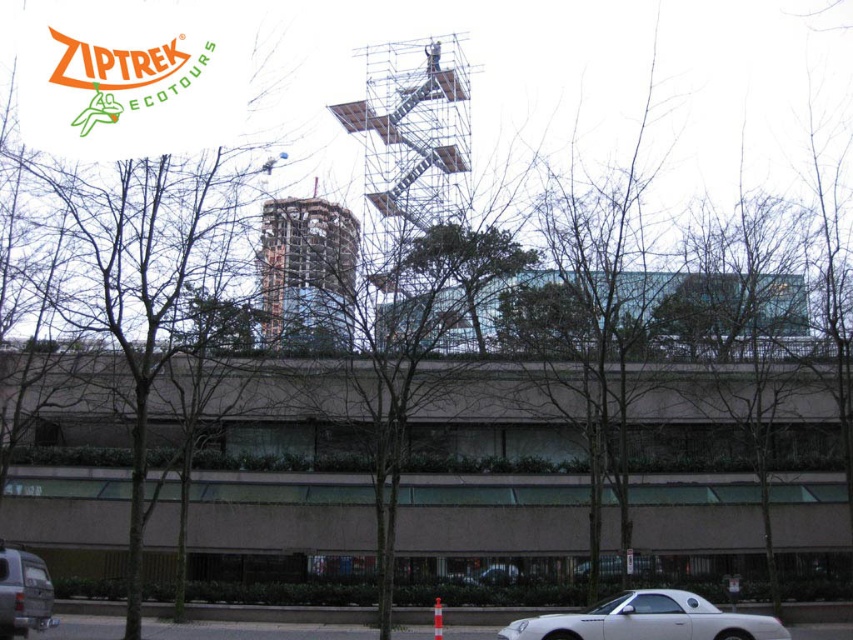
Can you confirm if silver metallic scaffolding at center is thinner than matte silver van at lower left?

Incorrect, silver metallic scaffolding at center's width is not less than matte silver van at lower left's.

Can you confirm if silver metallic scaffolding at center is positioned to the right of matte silver van at lower left?

Correct, you'll find silver metallic scaffolding at center to the right of matte silver van at lower left.

Between point (393, 218) and point (38, 560), which one is positioned behind?

The point (393, 218) is behind.

You are a GUI agent. You are given a task and a screenshot of the screen. Output one action in this format:
    pyautogui.click(x=<x>, y=<y>)
    Task: Click on the silver metallic scaffolding at center
    The width and height of the screenshot is (853, 640).
    Given the screenshot: What is the action you would take?
    click(x=410, y=147)

Is brown leafless tree at upper left positioned in front of white matte convertible at lower right?

Yes, it is.

Is brown leafless tree at upper left thinner than white matte convertible at lower right?

In fact, brown leafless tree at upper left might be wider than white matte convertible at lower right.

Between point (137, 204) and point (740, 630), which one is positioned in front?

Positioned in front is point (740, 630).

Locate an element on the screen. The height and width of the screenshot is (640, 853). brown leafless tree at upper left is located at coordinates (152, 186).

From the picture: Does green leafy tree at center appear on the left side of white matte convertible at lower right?

Correct, you'll find green leafy tree at center to the left of white matte convertible at lower right.

Between green leafy tree at center and white matte convertible at lower right, which one has more height?

green leafy tree at center

Who is more distant from viewer, (434, 326) or (672, 598)?

The point (434, 326) is behind.

Where is `green leafy tree at center`? green leafy tree at center is located at coordinates (416, 352).